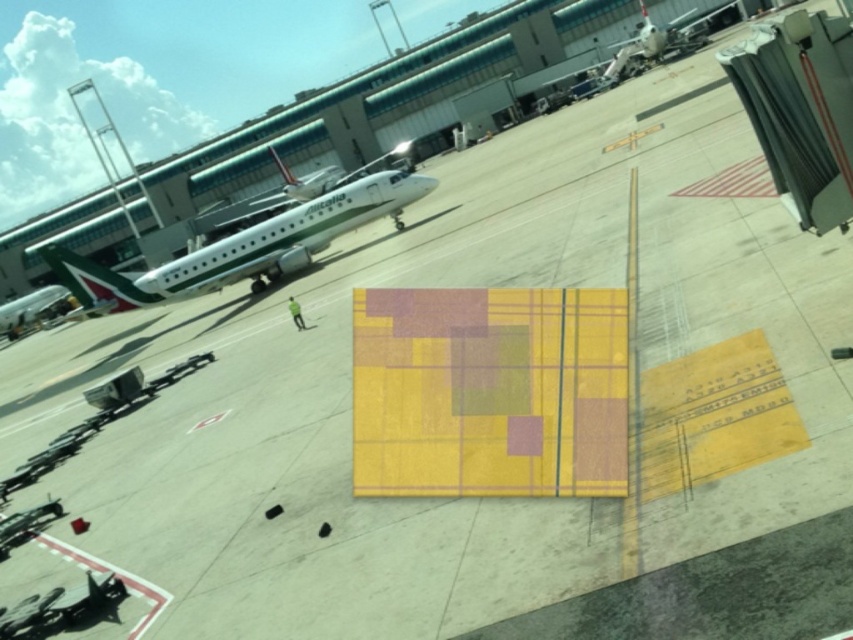
Question: Is white glossy airplane at upper center to the left of metallic silver airplane at left from the viewer's perspective?

Choices:
 (A) yes
 (B) no

Answer: (B)

Question: Is white glossy airplane at upper right thinner than metallic silver airplane at left?

Choices:
 (A) no
 (B) yes

Answer: (B)

Question: Based on their relative distances, which object is farther from the white glossy airplane at upper center?

Choices:
 (A) white glossy airplane at upper right
 (B) metallic silver airplane at left

Answer: (B)

Question: Does white glossy airplane at upper center come in front of metallic silver airplane at left?

Choices:
 (A) no
 (B) yes

Answer: (B)

Question: Among these points, which one is farthest from the camera?

Choices:
 (A) (686, 36)
 (B) (257, 250)

Answer: (A)

Question: Which of the following is the closest to the observer?

Choices:
 (A) (33, 291)
 (B) (639, 52)
 (C) (115, 305)

Answer: (C)